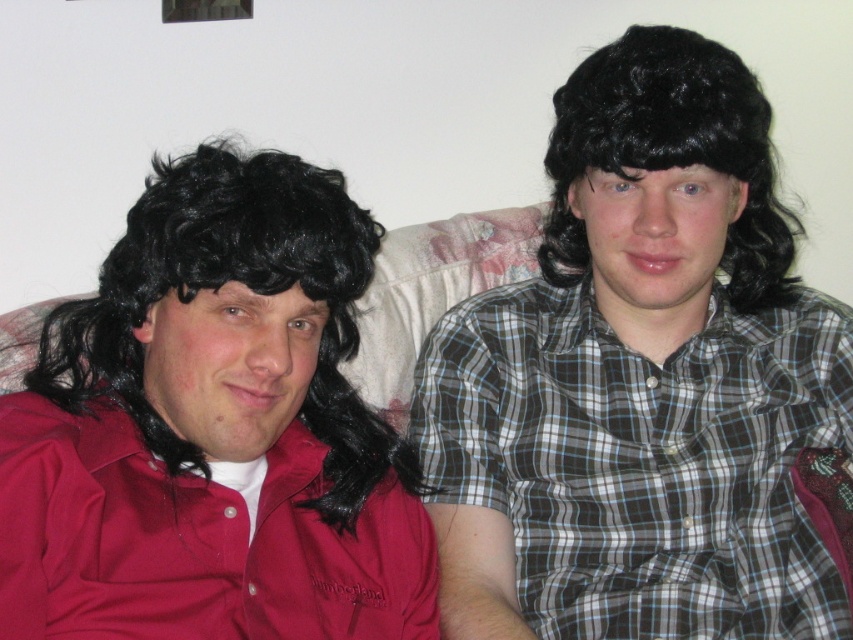
Is matte black wig at left closer to the viewer compared to plaid shirt at right?

Yes, matte black wig at left is in front of plaid shirt at right.

Find the location of a particular element. matte black wig at left is located at coordinates (213, 429).

Between point (405, 634) and point (558, 554), which one is positioned in front?

Positioned in front is point (405, 634).

Find the location of a particular element. This screenshot has width=853, height=640. matte black wig at left is located at coordinates (213, 429).

Can you confirm if plaid shirt at right is positioned above black curly wig at upper right?

Actually, plaid shirt at right is below black curly wig at upper right.

Measure the distance between point (764,417) and camera.

3.72 feet

The width and height of the screenshot is (853, 640). In order to click on plaid shirt at right in this screenshot , I will do `click(642, 460)`.

Which is above, matte black wig at left or black curly wig at upper right?

black curly wig at upper right

Can you confirm if matte black wig at left is taller than black curly wig at upper right?

Correct, matte black wig at left is much taller as black curly wig at upper right.

Is point (94, 611) positioned after point (723, 154)?

No, it is in front of (723, 154).

Where is `matte black wig at left`? matte black wig at left is located at coordinates (213, 429).